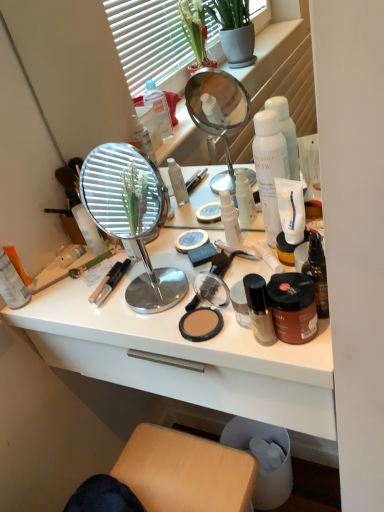
I want to click on free space that is in between orange matte lotion at left, positioned as the first toiletry in left-to-right order, and white matte spray can at center right, the first product positioned from the top, so click(127, 278).